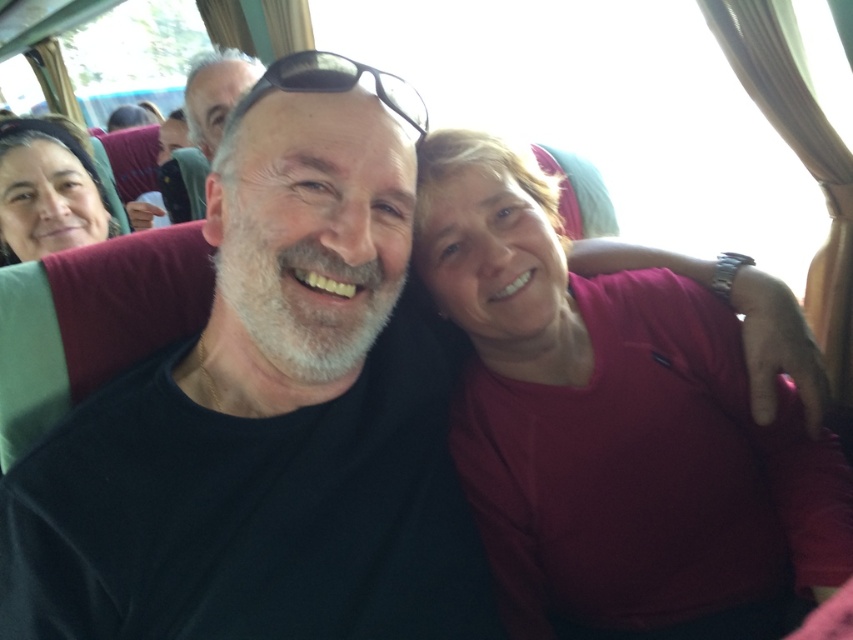
Which is more to the right, black matte shirt at center or black matte sunglasses at center?

black matte sunglasses at center

Does point (267, 291) lie in front of point (312, 90)?

Yes, point (267, 291) is closer to viewer.

You are a GUI agent. You are given a task and a screenshot of the screen. Output one action in this format:
    pyautogui.click(x=<x>, y=<y>)
    Task: Click on the black matte shirt at center
    The image size is (853, 640).
    Given the screenshot: What is the action you would take?
    pyautogui.click(x=268, y=416)

In the scene shown: Can you confirm if black matte shirt at center is shorter than matte black hair at left?

In fact, black matte shirt at center may be taller than matte black hair at left.

Between point (228, 586) and point (79, 193), which one is positioned behind?

Positioned behind is point (79, 193).

This screenshot has width=853, height=640. What do you see at coordinates (268, 416) in the screenshot? I see `black matte shirt at center` at bounding box center [268, 416].

Find the location of a particular element. black matte shirt at center is located at coordinates (268, 416).

Does matte black hair at left lie behind black matte sunglasses at center?

Yes, it is behind black matte sunglasses at center.

Does point (62, 141) come farther from viewer compared to point (405, 120)?

Yes, point (62, 141) is behind point (405, 120).

Identify the location of matte black hair at left. (47, 192).